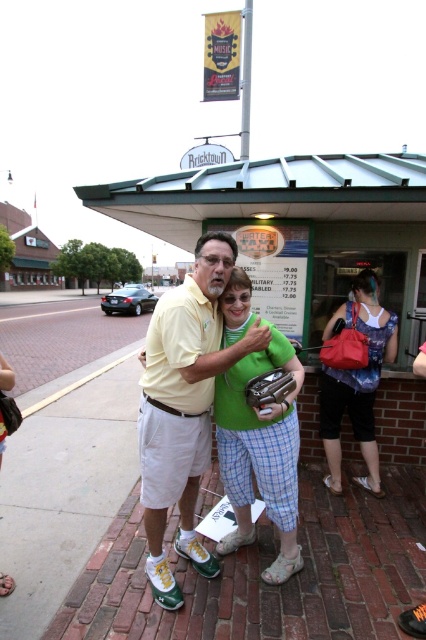
You are a photographer standing in front of the Bricktown ticket booth. You notice a green fabric purse at center and a matte blue dress at center in the scene. Which object is positioned lower in the image?

The green fabric purse at center is positioned below the matte blue dress at center, so it is lower in the image.

You are a photographer standing in front of the Bricktown ticket booth. You see a man wearing a yellow cotton shirt at center and a green fabric purse at center. Which object is taller?

The yellow cotton shirt at center is much taller than the green fabric purse at center.